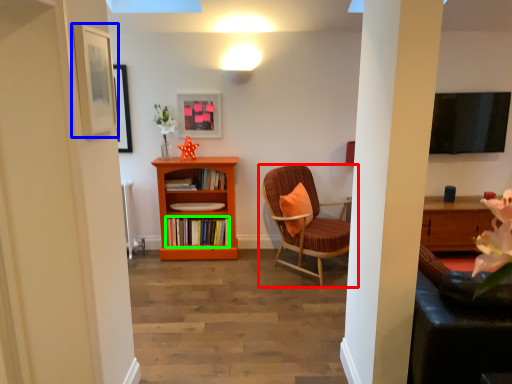
Question: Based on their relative distances, which object is farther from chair (highlighted by a red box)? Choose from picture frame (highlighted by a blue box) and book (highlighted by a green box).

Choices:
 (A) picture frame
 (B) book

Answer: (A)